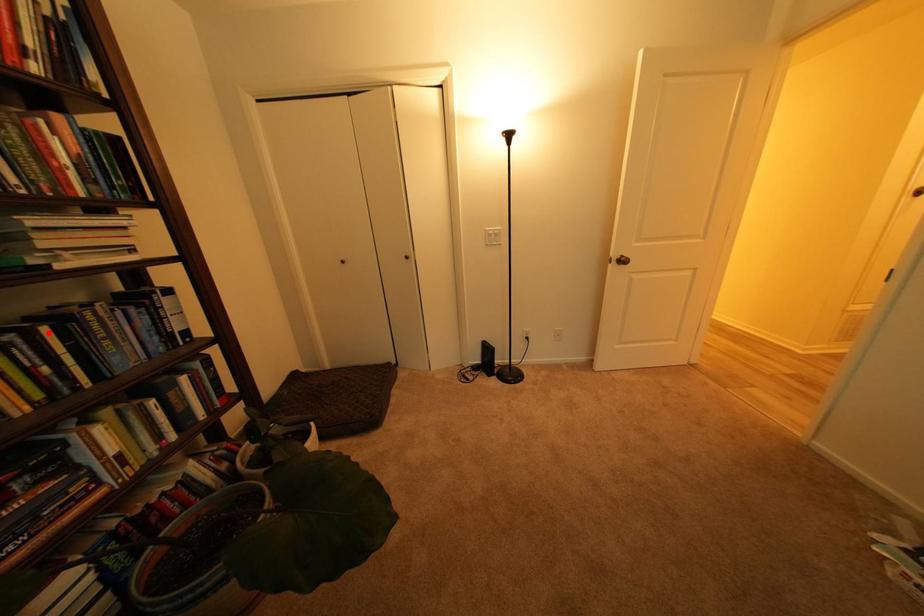
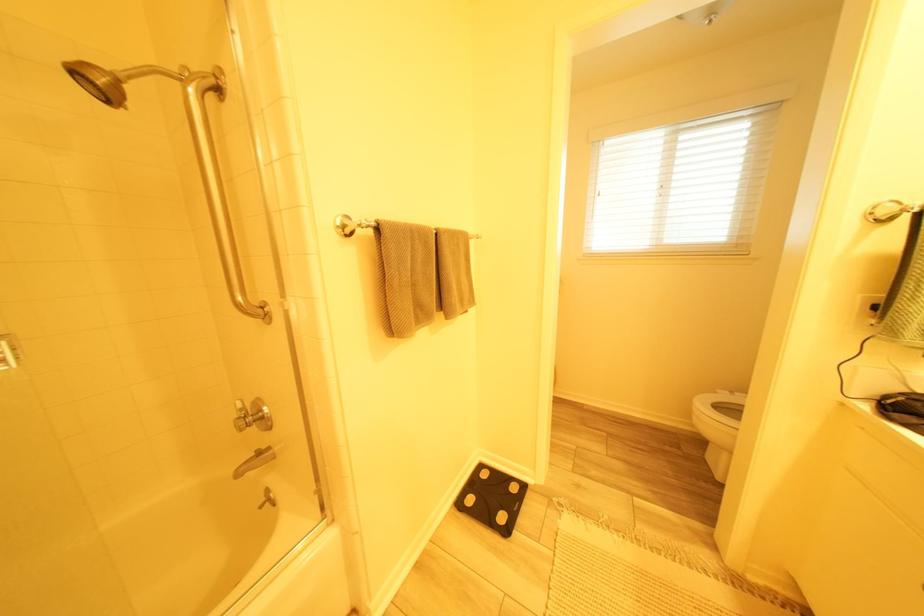
Question: I am providing you with two images of the same scene from different viewpoints. A red point is marked on the first image. Can you still see the location of the red point in image 2?

Choices:
 (A) Yes
 (B) No

Answer: (B)